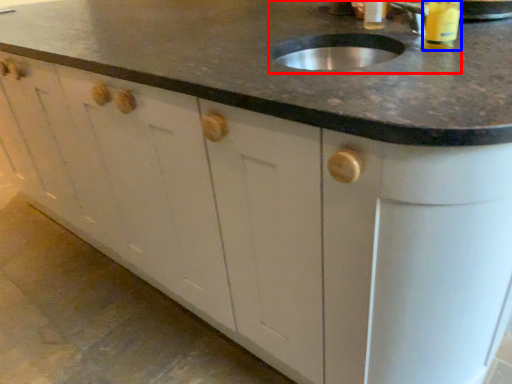
Question: Which object is closer to the camera taking this photo, sink (highlighted by a red box) or beverage (highlighted by a blue box)?

Choices:
 (A) sink
 (B) beverage

Answer: (A)